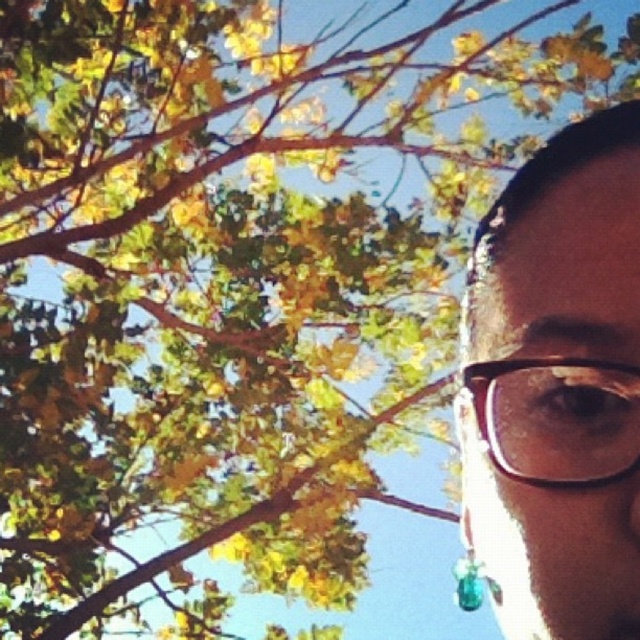
Does brown matte glasses at right have a smaller size compared to translucent teal pendant at lower right?

Actually, brown matte glasses at right might be larger than translucent teal pendant at lower right.

Does point (497, 336) lie in front of point (490, 586)?

Yes, point (497, 336) is in front of point (490, 586).

Where is `brown matte glasses at right`? This screenshot has width=640, height=640. brown matte glasses at right is located at coordinates (557, 387).

Does translucent plastic glasses at right have a greater width compared to translucent teal pendant at lower right?

Yes.

Can you confirm if translucent plastic glasses at right is positioned below translucent teal pendant at lower right?

No.

The width and height of the screenshot is (640, 640). What do you see at coordinates (556, 419) in the screenshot?
I see `translucent plastic glasses at right` at bounding box center [556, 419].

Where is `translucent plastic glasses at right`? translucent plastic glasses at right is located at coordinates (556, 419).

Who is more distant from viewer, (497, 413) or (504, 448)?

The point (497, 413) is more distant.

Which is above, brown matte glasses at right or translucent plastic glasses at right?

translucent plastic glasses at right is higher up.

Does point (566, 556) lie in front of point (592, 404)?

Yes, point (566, 556) is in front of point (592, 404).

Where is `brown matte glasses at right`? The image size is (640, 640). brown matte glasses at right is located at coordinates (557, 387).